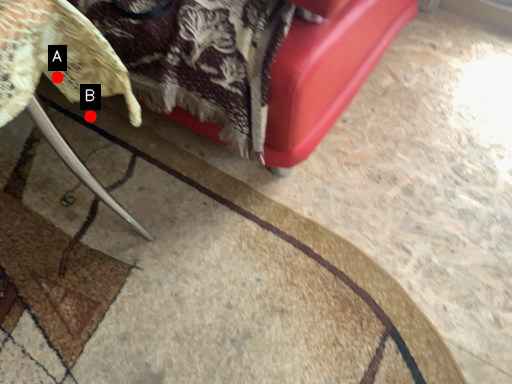
Question: Two points are circled on the image, labeled by A and B beside each circle. Which point is closer to the camera?

Choices:
 (A) A is closer
 (B) B is closer

Answer: (A)